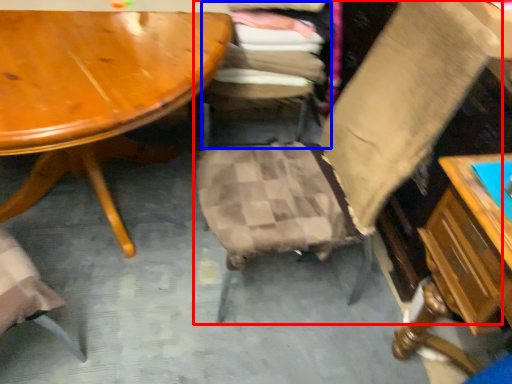
Question: Which object appears farthest to the camera in this image, chair (highlighted by a red box) or chair (highlighted by a blue box)?

Choices:
 (A) chair
 (B) chair

Answer: (B)